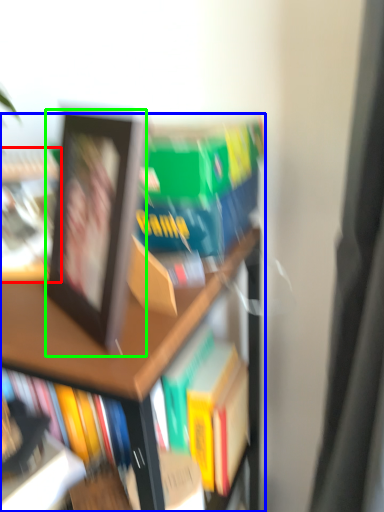
Question: Which object is the closest to the book (highlighted by a red box)? Choose among these: bookcase (highlighted by a blue box) or picture frame (highlighted by a green box).

Choices:
 (A) bookcase
 (B) picture frame

Answer: (B)